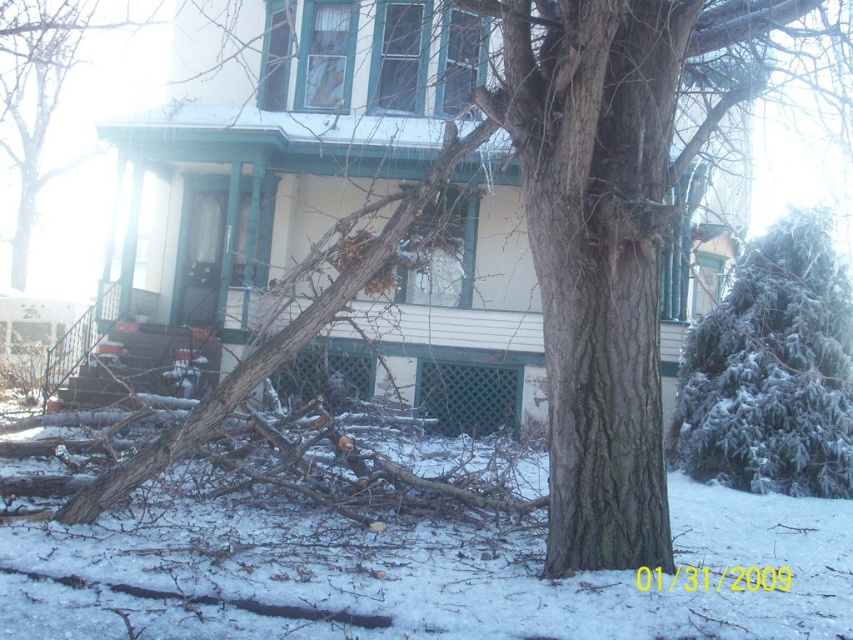
Looking at this image, you are a delivery person trying to deliver a package to the house. The path to the house is between the green textured evergreen at right and the brown rough bark tree at upper center. Can you pass through this path if your delivery cart is 2 meters wide?

The distance between the green textured evergreen at right and the brown rough bark tree at upper center is 21.08 meters. Since the cart is only 2 meters wide, it can easily pass through the path between them.

You are standing at the point with coordinates point (74, 48) and want to walk to the point with coordinates point (844, 401). According to the image, will you have to go around any obstacles along the way?

Point (844, 401) is in front of point (74, 48), so you will not have to go around any obstacles along the way.